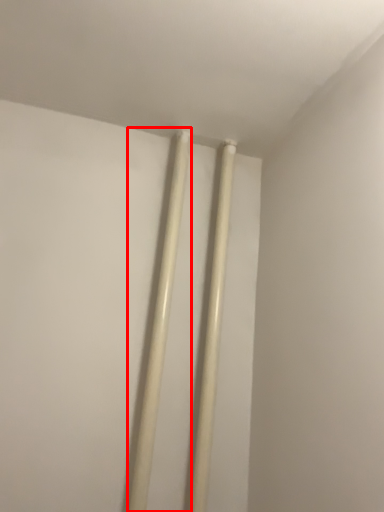
Question: From the image's perspective, considering the relative positions of chopsticks (annotated by the red box) and beam in the image provided, where is chopsticks (annotated by the red box) located with respect to the staircase?

Choices:
 (A) above
 (B) below

Answer: (A)